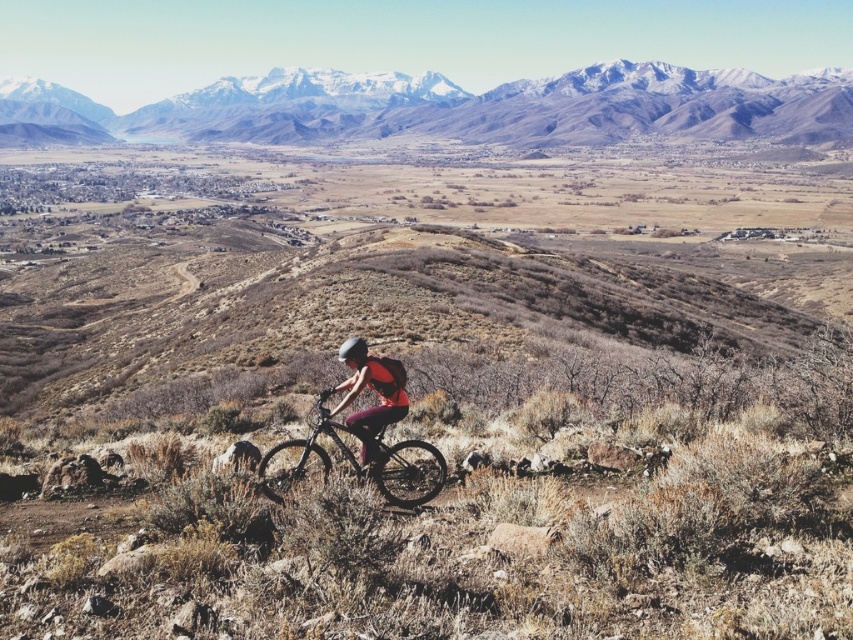
You are a photographer trying to capture the snowy rocky mountain at upper center and the shiny black frame at center in your shot. Which object should you focus on first to ensure both are in focus?

You should focus on the snowy rocky mountain at upper center first because it is closer to you than the shiny black frame at center, so focusing on it first will help ensure both objects are in focus.

You are a hiker planning to take a photo of the snowy rocky mountain at upper center and the matte pink shorts at center. The camera you have can capture objects within a 2000 feet range. Will both objects fit in the same frame?

The snowy rocky mountain at upper center and the matte pink shorts at center are 2203.23 feet apart from each other, which exceeds the camera range of 2000 feet. Therefore, both objects cannot fit in the same frame.

You are a photographer trying to capture a clear shot of the shiny black frame at center and the matte pink shorts at center. Which object should you focus on first if you want to ensure both are in focus?

The shiny black frame at center is positioned under matte pink shorts at center, so focusing on the matte pink shorts at center first will ensure both are in focus.